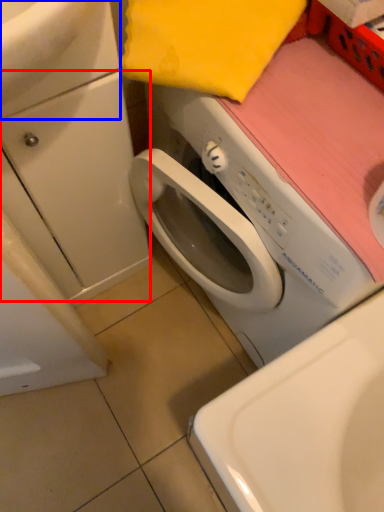
Question: Which of the following is the farthest to the observer, drawer (highlighted by a red box) or sink (highlighted by a blue box)?

Choices:
 (A) drawer
 (B) sink

Answer: (A)